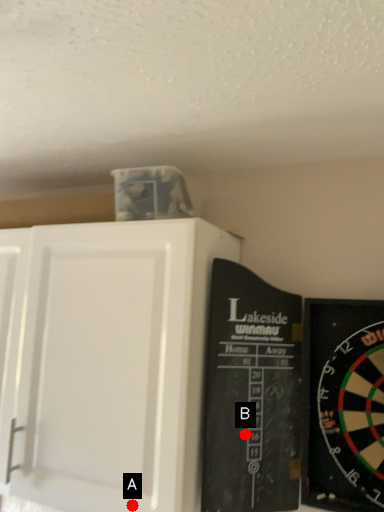
Question: Two points are circled on the image, labeled by A and B beside each circle. Which of the following is the closest to the observer?

Choices:
 (A) A is closer
 (B) B is closer

Answer: (A)